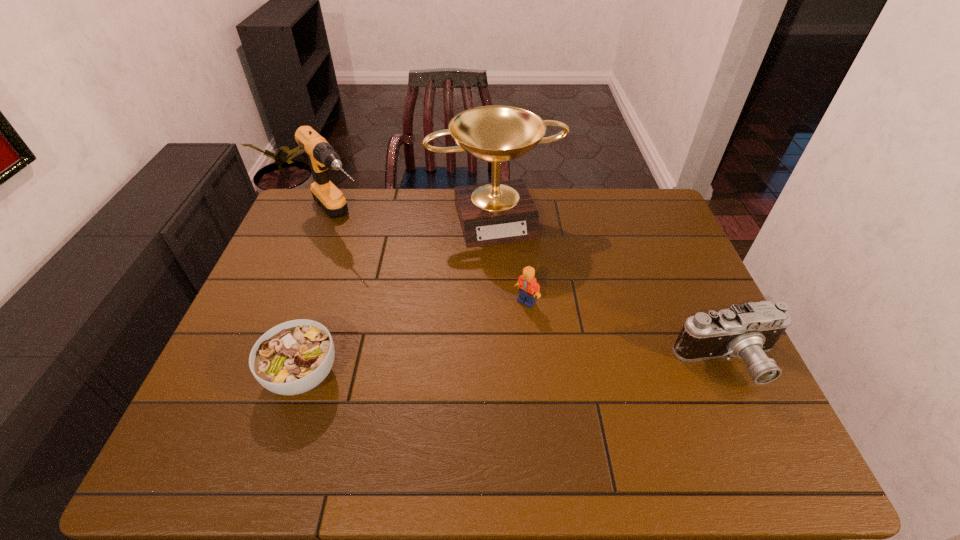
This screenshot has width=960, height=540. In order to click on free region located 0.290m at the tip of the drill in this screenshot , I will do `click(405, 291)`.

Where is `vacant space located at the tip of the drill`? vacant space located at the tip of the drill is located at coordinates (382, 266).

Find the location of `vacant space situated 0.250m at the tip of the drill`. vacant space situated 0.250m at the tip of the drill is located at coordinates (397, 283).

What are the coordinates of `free space located on the front-facing side of the Lego` in the screenshot? It's located at (495, 385).

What are the coordinates of `vacant space located 0.220m on the front-facing side of the Lego` in the screenshot? It's located at 499,374.

Where is `free space located 0.070m on the front-facing side of the Lego`? free space located 0.070m on the front-facing side of the Lego is located at coordinates (516, 328).

Identify the location of award that is at the far edge. The image size is (960, 540). (492, 213).

The height and width of the screenshot is (540, 960). I want to click on drill present at the far edge, so click(x=322, y=156).

Locate an element on the screen. soup bowl that is at the near edge is located at coordinates [x=293, y=357].

Where is `camera at the near edge`? The image size is (960, 540). camera at the near edge is located at coordinates (747, 331).